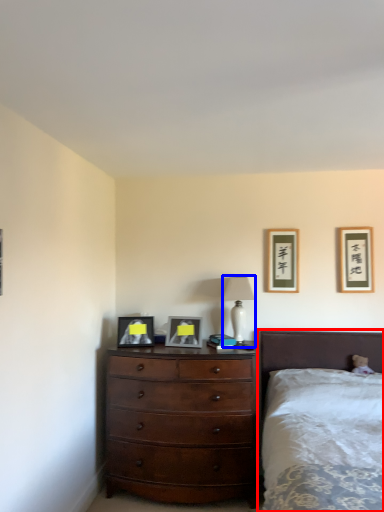
Question: Which of the following is the farthest to the observer, bed (highlighted by a red box) or table lamp (highlighted by a blue box)?

Choices:
 (A) bed
 (B) table lamp

Answer: (B)